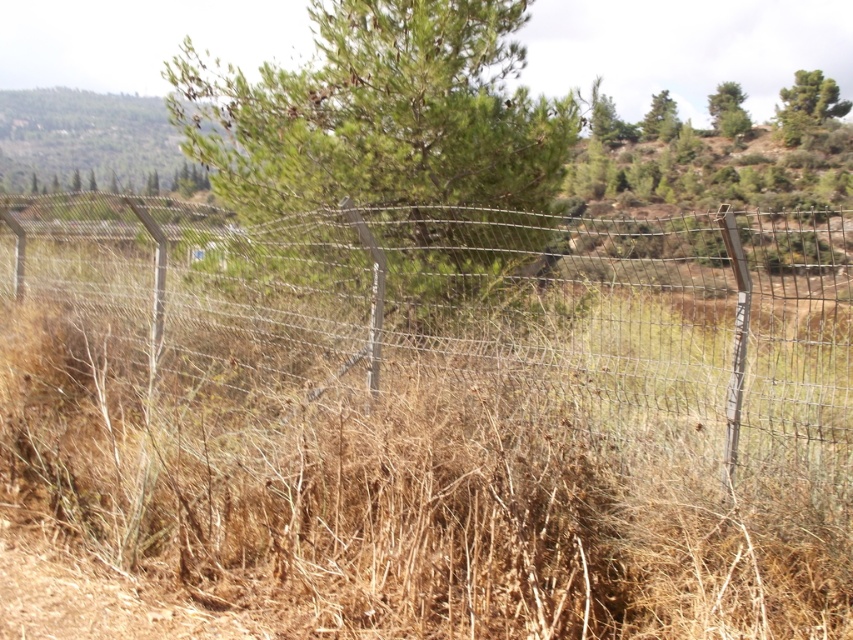
Question: Which object is the farthest from the green textured tree at upper right?

Choices:
 (A) green leafy tree at center
 (B) green matte tree at upper right
 (C) green leafy tree at upper right
 (D) wire mesh fence at center

Answer: (A)

Question: Among these objects, which one is nearest to the camera?

Choices:
 (A) green leafy tree at center
 (B) green textured tree at upper right

Answer: (A)

Question: Can you confirm if green leafy tree at center is positioned above green textured tree at upper right?

Choices:
 (A) no
 (B) yes

Answer: (A)

Question: Which of the following is the farthest from the observer?

Choices:
 (A) (456, 20)
 (B) (747, 376)
 (C) (827, 80)
 (D) (718, 93)

Answer: (D)

Question: Is wire mesh fence at center bigger than green textured tree at upper right?

Choices:
 (A) no
 (B) yes

Answer: (B)

Question: Is green leafy tree at center thinner than green leafy tree at upper right?

Choices:
 (A) yes
 (B) no

Answer: (B)